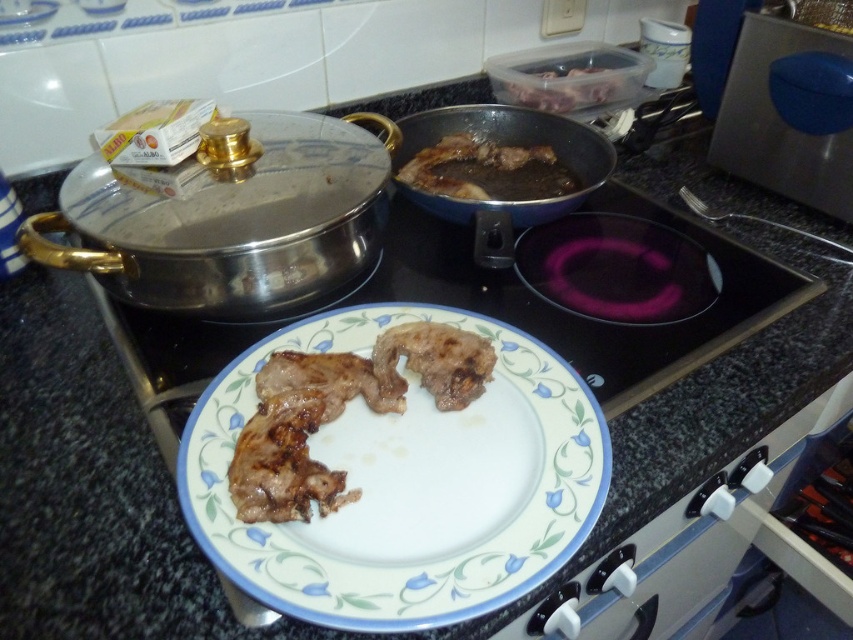
Question: Among these points, which one is nearest to the camera?

Choices:
 (A) (236, 312)
 (B) (701, 209)

Answer: (A)

Question: Among these objects, which one is farthest from the camera?

Choices:
 (A) shiny metallic frying pan at upper left
 (B) white ceramic plate at center
 (C) translucent plastic container at upper right

Answer: (C)

Question: Is shiny dark blue frying pan at upper center wider than brown glossy meat at center?

Choices:
 (A) no
 (B) yes

Answer: (B)

Question: Can you confirm if shiny metallic frying pan at upper left is positioned below brown glossy meat at center?

Choices:
 (A) yes
 (B) no

Answer: (A)

Question: Does white ceramic plate at center have a smaller size compared to translucent plastic container at upper right?

Choices:
 (A) no
 (B) yes

Answer: (A)

Question: Among these points, which one is farthest from the camera?

Choices:
 (A) (460, 408)
 (B) (561, 160)

Answer: (B)